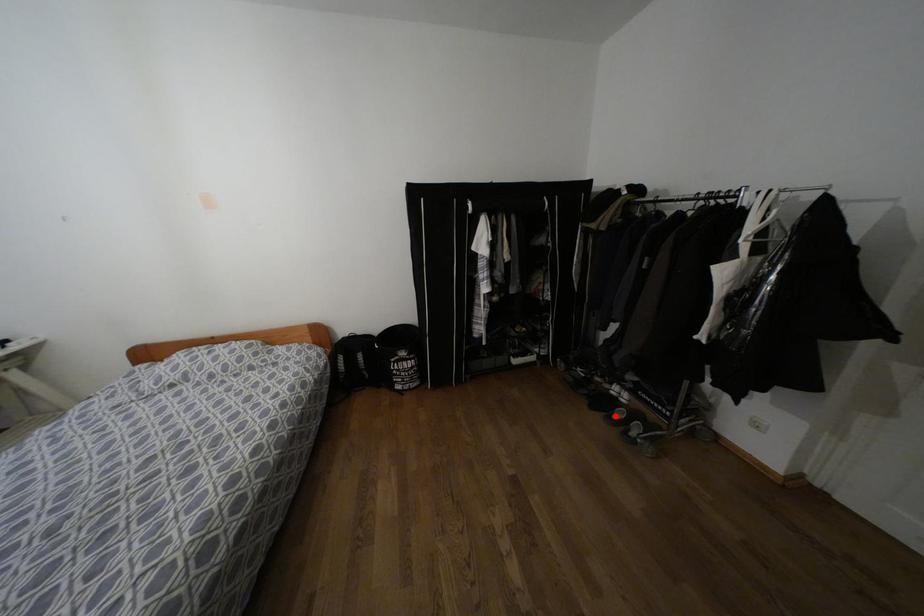
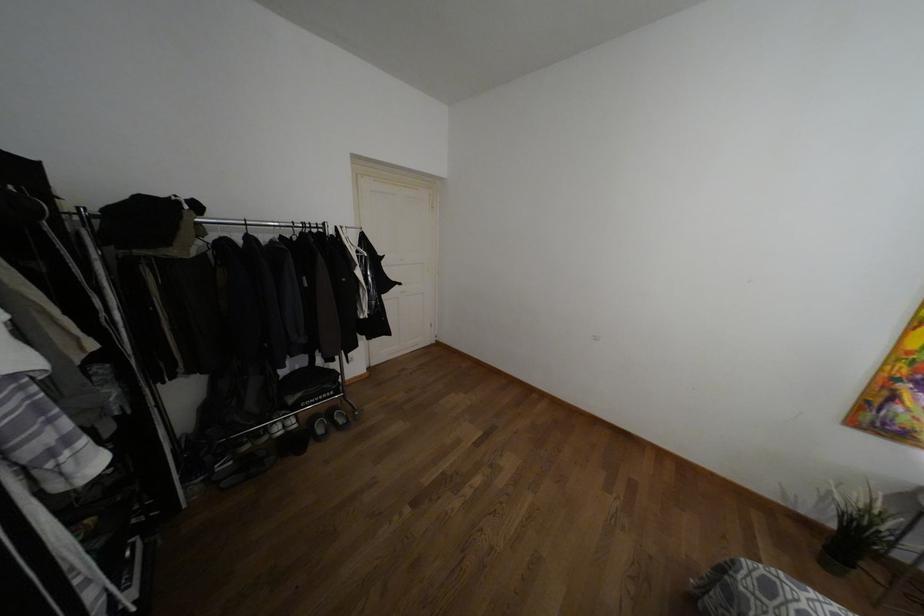
Locate, in the second image, the point that corresponds to the highlighted location in the first image.

(320, 430)